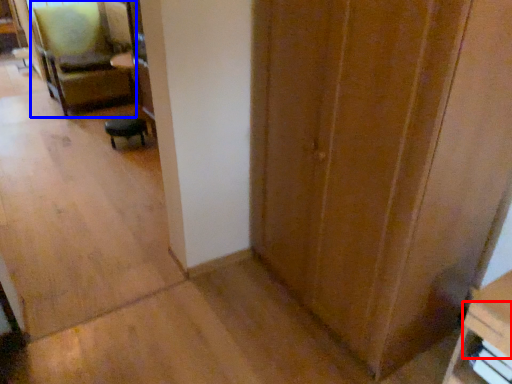
Question: Among these objects, which one is nearest to the camera, drawer (highlighted by a red box) or chair (highlighted by a blue box)?

Choices:
 (A) drawer
 (B) chair

Answer: (A)